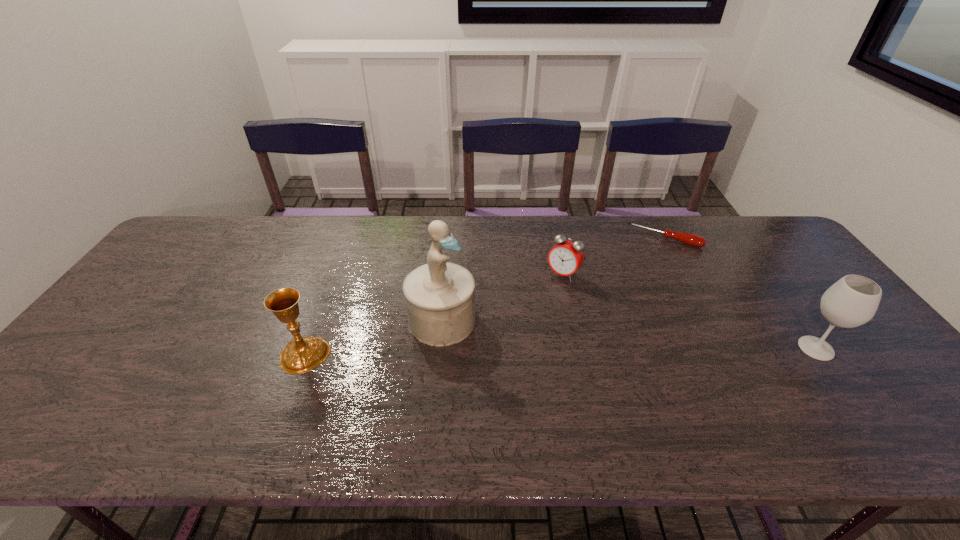
The height and width of the screenshot is (540, 960). In order to click on vacant space on the desktop that is between the leftmost object and the wineglass and is positioned at the beak of the tallest object in this screenshot , I will do `click(516, 352)`.

Locate an element on the screen. The width and height of the screenshot is (960, 540). vacant spot on the desktop that is between the chalice and the wineglass and is positioned on the front-facing side of the alarm clock is located at coordinates (500, 352).

What are the coordinates of `free space on the desktop that is between the leftmost object and the rightmost object and is positioned at the tip of the farthest object` in the screenshot? It's located at (622, 350).